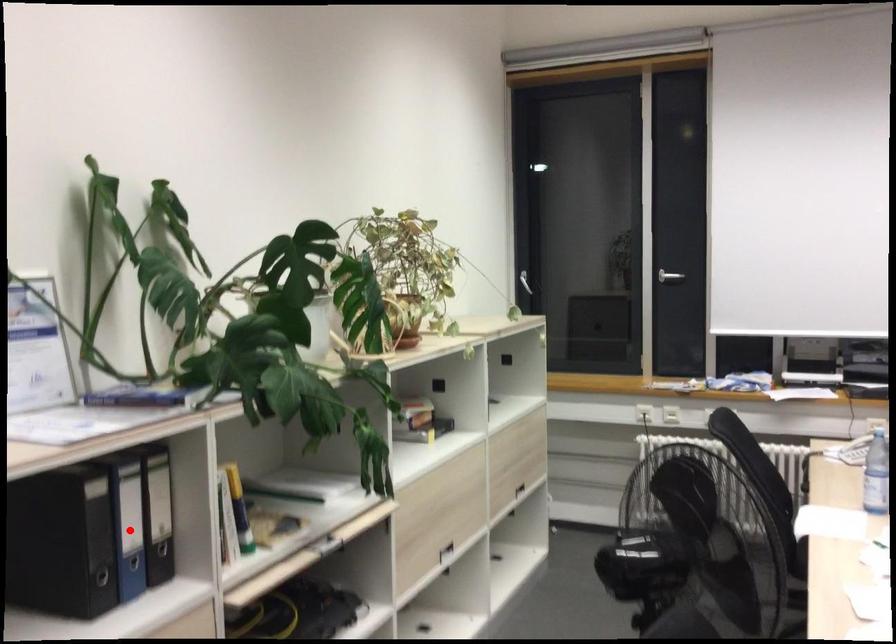
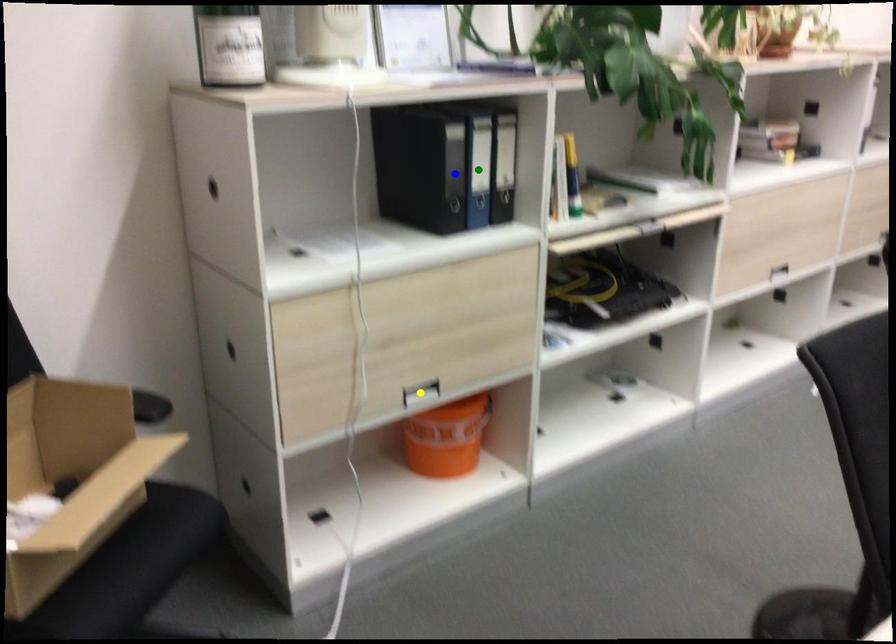
Question: I am providing you with two images of the same scene from different viewpoints. A red point is marked on the first image. You are given multiple points on the second image. Which spot in image 2 lines up with the point in image 1?

Choices:
 (A) green point
 (B) blue point
 (C) yellow point

Answer: (A)